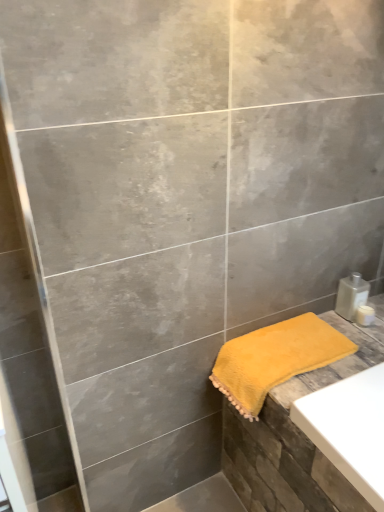
Question: Does clear plastic bottle at lower right touch yellow fluffy towel at lower right?

Choices:
 (A) no
 (B) yes

Answer: (A)

Question: Does clear plastic bottle at lower right turn towards yellow fluffy towel at lower right?

Choices:
 (A) yes
 (B) no

Answer: (B)

Question: Does clear plastic bottle at lower right appear on the right side of yellow fluffy towel at lower right?

Choices:
 (A) no
 (B) yes

Answer: (B)

Question: Can you confirm if clear plastic bottle at lower right is wider than yellow fluffy towel at lower right?

Choices:
 (A) no
 (B) yes

Answer: (A)

Question: From a real-world perspective, does clear plastic bottle at lower right sit lower than yellow fluffy towel at lower right?

Choices:
 (A) no
 (B) yes

Answer: (A)

Question: From the image's perspective, is clear plastic bottle at lower right on top of yellow fluffy towel at lower right?

Choices:
 (A) no
 (B) yes

Answer: (B)

Question: Is white plastic container at right bigger than yellow fluffy towel at lower right?

Choices:
 (A) no
 (B) yes

Answer: (A)

Question: Is white plastic container at right completely or partially outside of yellow fluffy towel at lower right?

Choices:
 (A) no
 (B) yes

Answer: (B)

Question: From the image's perspective, would you say white plastic container at right is positioned over yellow fluffy towel at lower right?

Choices:
 (A) no
 (B) yes

Answer: (B)

Question: Can you confirm if white plastic container at right is shorter than yellow fluffy towel at lower right?

Choices:
 (A) no
 (B) yes

Answer: (B)

Question: From a real-world perspective, is white plastic container at right on top of yellow fluffy towel at lower right?

Choices:
 (A) yes
 (B) no

Answer: (A)

Question: Does white plastic container at right appear on the left side of yellow fluffy towel at lower right?

Choices:
 (A) yes
 (B) no

Answer: (B)

Question: Can you confirm if yellow fluffy towel at lower right is thinner than clear plastic bottle at lower right?

Choices:
 (A) yes
 (B) no

Answer: (B)